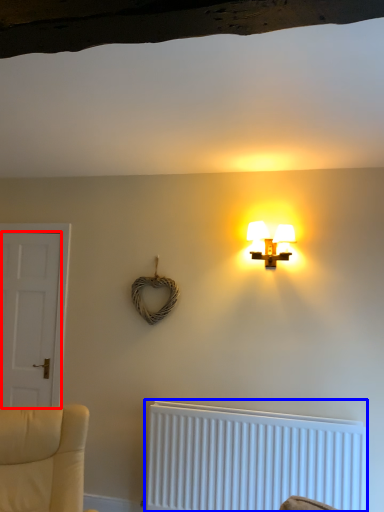
Question: Which object is closer to the camera taking this photo, door (highlighted by a red box) or radiator (highlighted by a blue box)?

Choices:
 (A) door
 (B) radiator

Answer: (B)